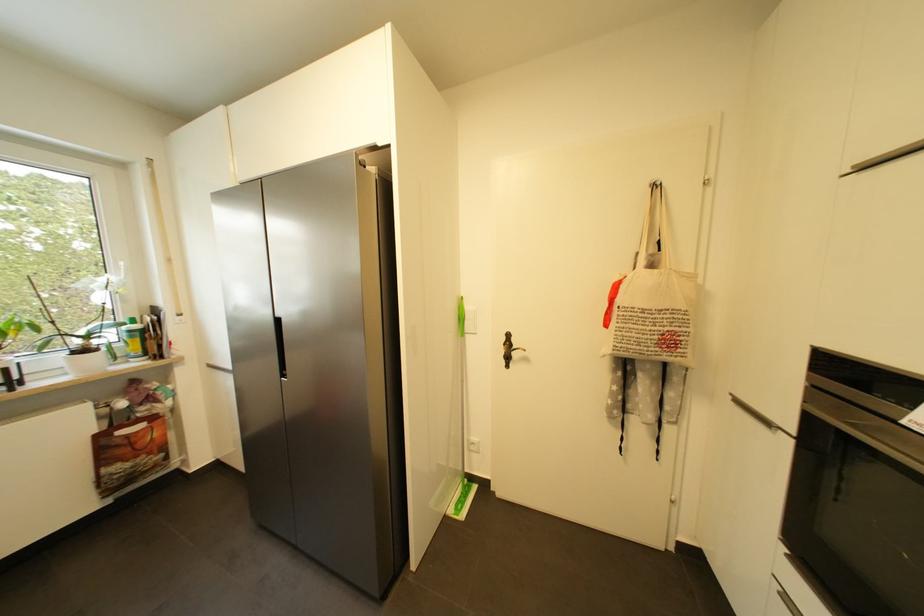
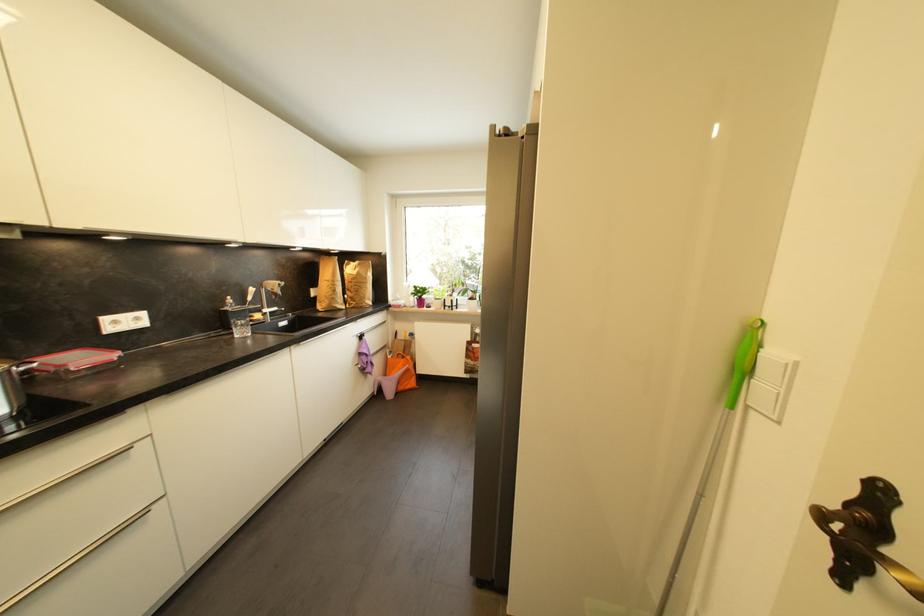
Question: How did the camera likely rotate?

Choices:
 (A) Left
 (B) Right
 (C) Up
 (D) Down

Answer: (A)